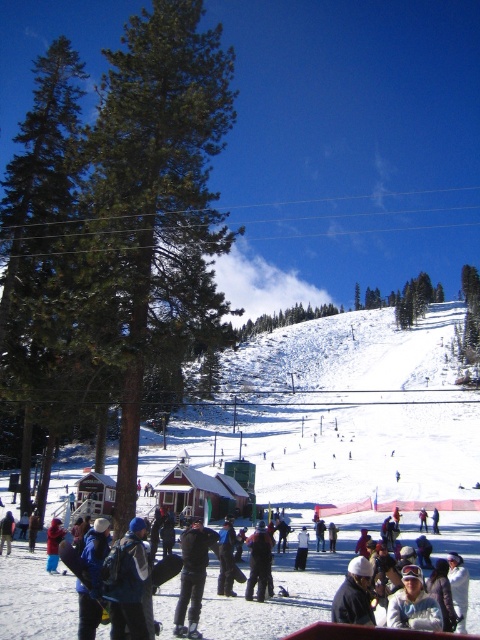
Question: Does blue woolen hat at lower left have a smaller size compared to dark blue jacket at lower left?

Choices:
 (A) yes
 (B) no

Answer: (B)

Question: Can you confirm if white matte jacket at center is wider than dark blue jacket at center?

Choices:
 (A) no
 (B) yes

Answer: (B)

Question: Based on their relative distances, which object is farther from the white snowboarder at center?

Choices:
 (A) dark blue jacket at lower left
 (B) white matte jacket at center
 (C) white powdery snow at center
 (D) dark blue jacket at center

Answer: (C)

Question: Where is white matte jacket at center located in relation to dark blue jacket at center in the image?

Choices:
 (A) right
 (B) left

Answer: (A)

Question: Among these points, which one is nearest to the camera?

Choices:
 (A) (361, 564)
 (B) (292, 609)

Answer: (A)

Question: Which object is closer to the camera taking this photo?

Choices:
 (A) dark blue jacket at center
 (B) white powdery snow at center
 (C) dark blue jacket at lower left
 (D) white snowboarder at center

Answer: (A)